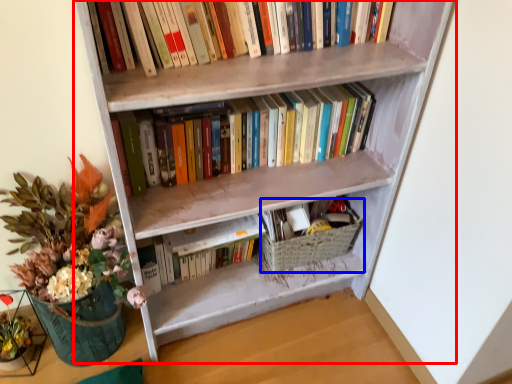
Question: Which object is further to the camera taking this photo, bookcase (highlighted by a red box) or basket (highlighted by a blue box)?

Choices:
 (A) bookcase
 (B) basket

Answer: (B)